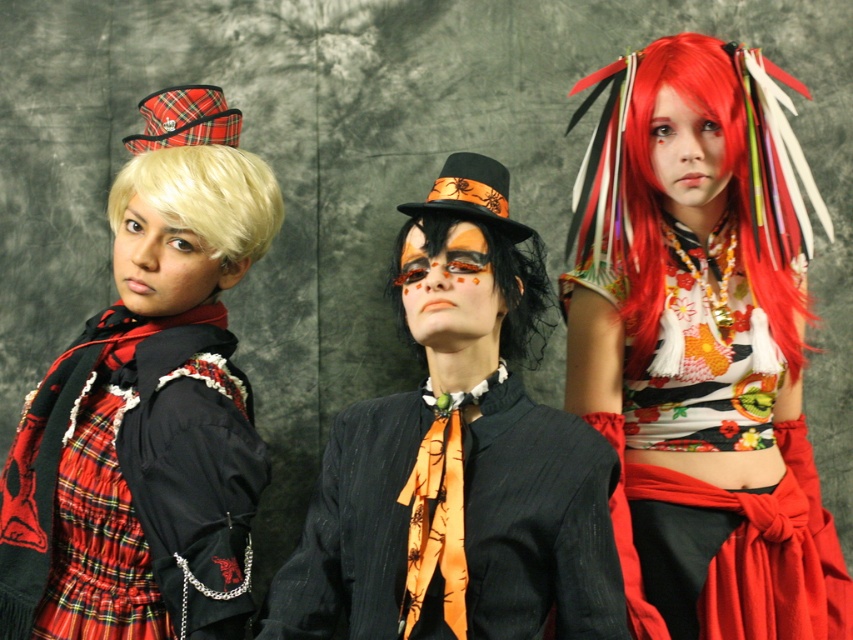
You are a photographer trying to capture the floral fabric top at center and the black matte wig at center in a single frame. Based on their positions, which object should you focus on first to ensure both are in the shot?

The black matte wig at center is to the left of the floral fabric top at center, so you should focus on the black matte wig at center first to ensure both are in the shot.